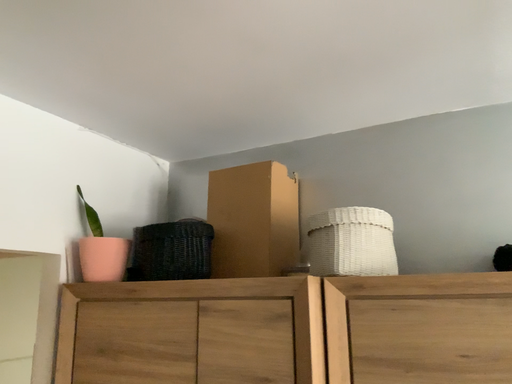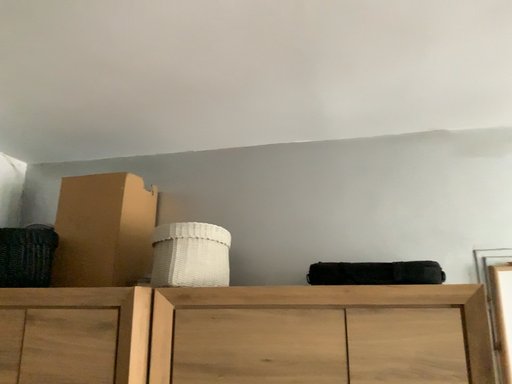
Question: How did the camera likely rotate when shooting the video?

Choices:
 (A) rotated left
 (B) rotated right

Answer: (B)